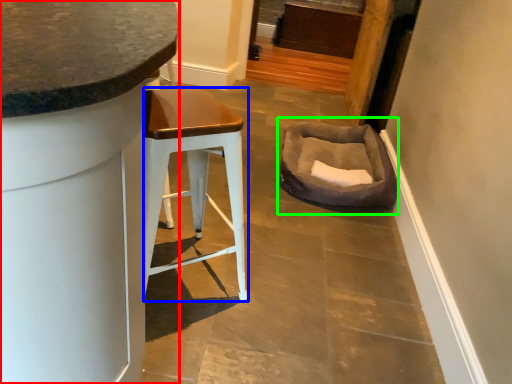
Question: Which object is positioned closest to cabinetry (highlighted by a red box)? Select from stool (highlighted by a blue box) and bean bag chair (highlighted by a green box).

Choices:
 (A) stool
 (B) bean bag chair

Answer: (A)